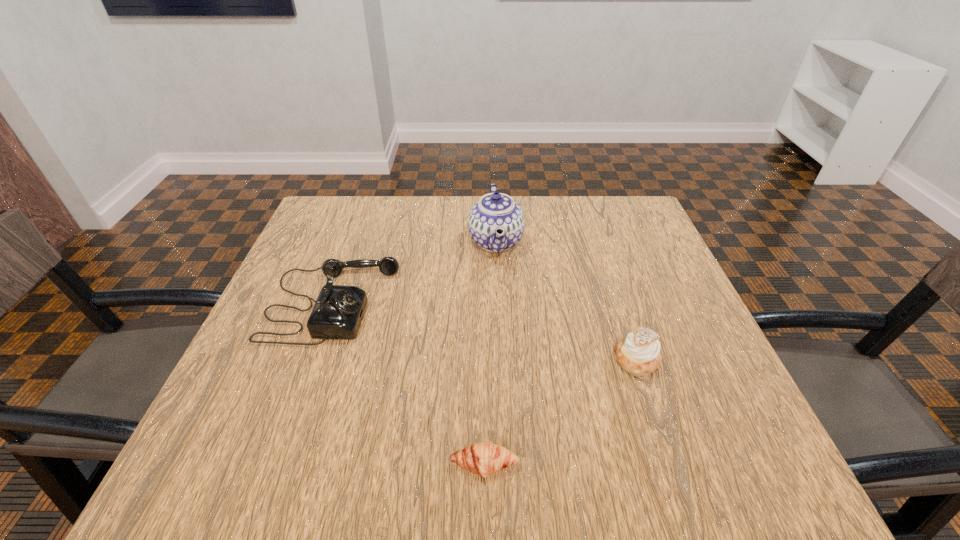
The image size is (960, 540). In order to click on the tallest object in this screenshot , I will do `click(496, 222)`.

Identify the location of the leftmost object. (338, 311).

Locate an element on the screen. The width and height of the screenshot is (960, 540). telephone is located at coordinates (338, 311).

You are a GUI agent. You are given a task and a screenshot of the screen. Output one action in this format:
    pyautogui.click(x=<x>, y=<y>)
    Task: Click on the rightmost object
    
    Given the screenshot: What is the action you would take?
    pyautogui.click(x=638, y=354)

Locate an element on the screen. The height and width of the screenshot is (540, 960). the farther pastry is located at coordinates (638, 354).

The width and height of the screenshot is (960, 540). In order to click on the nearest object in this screenshot , I will do `click(482, 458)`.

The width and height of the screenshot is (960, 540). Find the location of `the shorter pastry`. the shorter pastry is located at coordinates (482, 458).

The height and width of the screenshot is (540, 960). In order to click on vacant area situated 0.360m at the spout of the tallest object in this screenshot , I will do `click(326, 242)`.

You are a GUI agent. You are given a task and a screenshot of the screen. Output one action in this format:
    pyautogui.click(x=<x>, y=<y>)
    Task: Click on the vacant region located at the spout of the tallest object
    This screenshot has width=960, height=540.
    Given the screenshot: What is the action you would take?
    pyautogui.click(x=424, y=242)

Where is `vacant space located 0.130m at the spout of the tallest object`? vacant space located 0.130m at the spout of the tallest object is located at coordinates [417, 242].